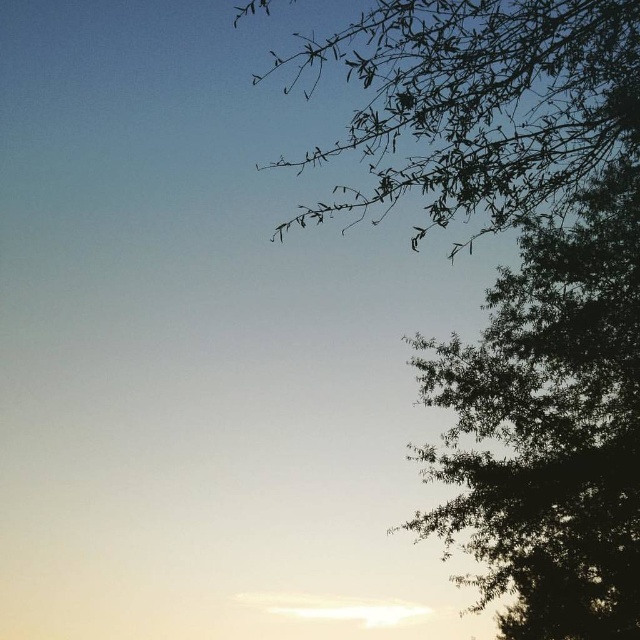
Question: Which point is farther to the camera?

Choices:
 (A) silhouette branches at upper right
 (B) silhouette leafy branch at upper right

Answer: (B)

Question: Is silhouette leafy branch at upper right closer to the viewer compared to green leafy tree at upper right?

Choices:
 (A) no
 (B) yes

Answer: (B)

Question: Which of the following is the closest to the observer?

Choices:
 (A) green leafy tree at upper right
 (B) silhouette branches at upper right
 (C) silhouette leafy branch at upper right

Answer: (B)

Question: Which object is the farthest from the green leafy tree at upper right?

Choices:
 (A) silhouette branches at upper right
 (B) silhouette leafy branch at upper right

Answer: (A)

Question: From the image, what is the correct spatial relationship of silhouette leafy branch at upper right in relation to silhouette branches at upper right?

Choices:
 (A) right
 (B) left

Answer: (A)

Question: Can you confirm if silhouette leafy branch at upper right is wider than silhouette branches at upper right?

Choices:
 (A) no
 (B) yes

Answer: (B)